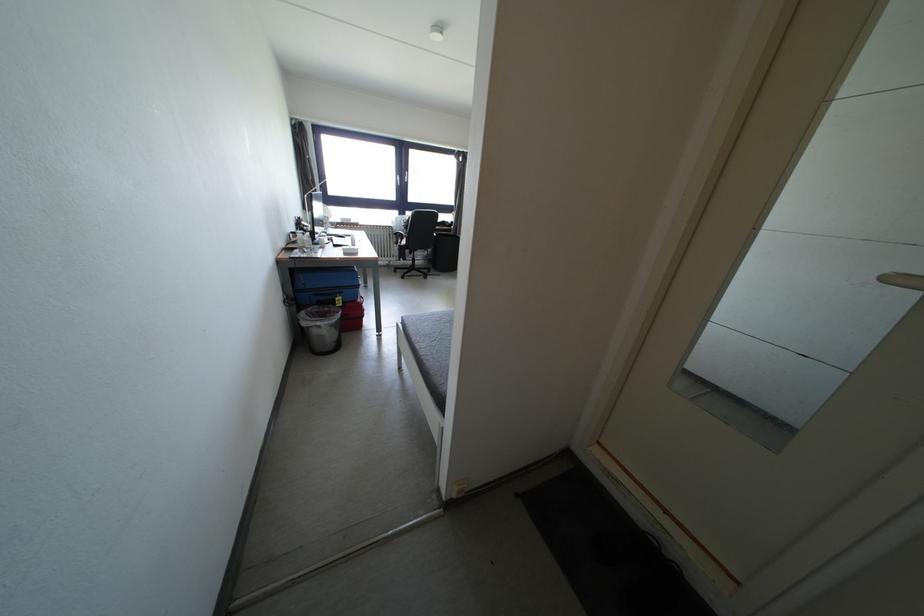
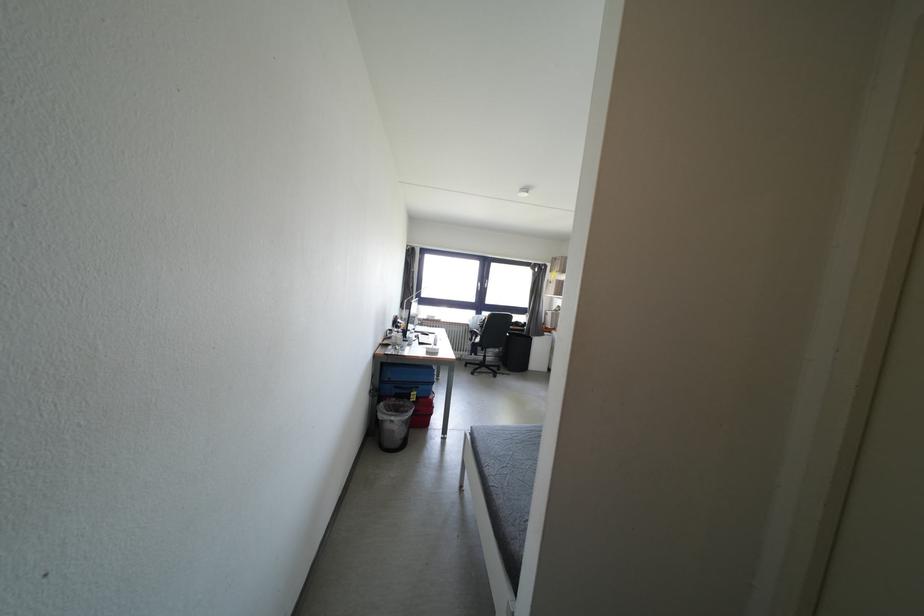
In the scene shown: The images are taken continuously from a first-person perspective. In which direction are you moving?

The cameraman walked toward left, backward.